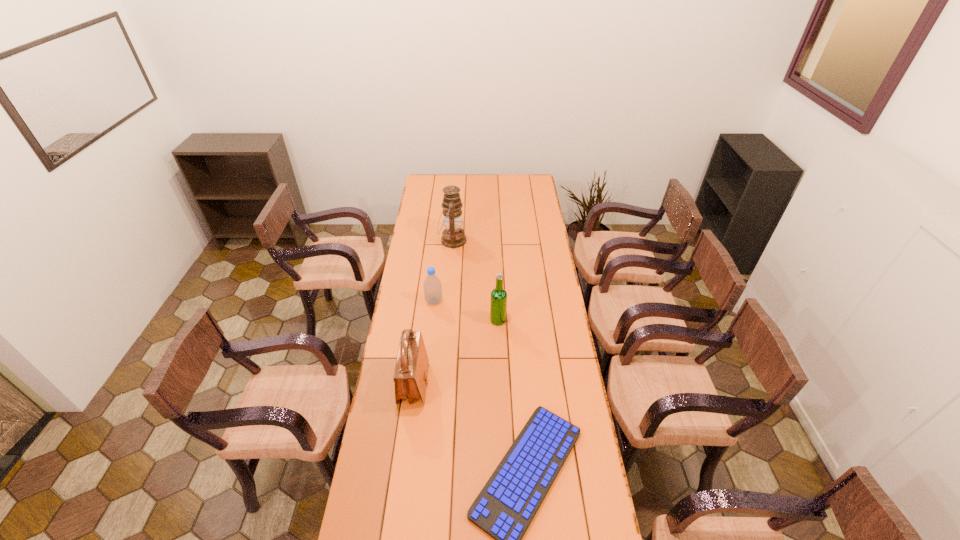
At what (x,y) coordinates should I click in order to perform the action: click on empty space between the third nearest object and the shoulder bag. Please return your answer as a coordinate pair (x, y). The height and width of the screenshot is (540, 960). Looking at the image, I should click on (456, 352).

Where is `free spot between the third nearest object and the second nearest object`? free spot between the third nearest object and the second nearest object is located at coordinates (456, 352).

I want to click on object that is the closest to the computer keyboard, so click(x=411, y=372).

Image resolution: width=960 pixels, height=540 pixels. What are the coordinates of `object that is the second closest one to the shoulder bag` in the screenshot? It's located at (432, 285).

Locate an element on the screen. Image resolution: width=960 pixels, height=540 pixels. free spot that satisfies the following two spatial constraints: 1. on the front side of the lantern; 2. on the left side of the beer bottle is located at coordinates (446, 320).

Identify the location of vacant space that satisfies the following two spatial constraints: 1. on the front side of the second farthest object; 2. on the front flap of the second nearest object. The height and width of the screenshot is (540, 960). (425, 384).